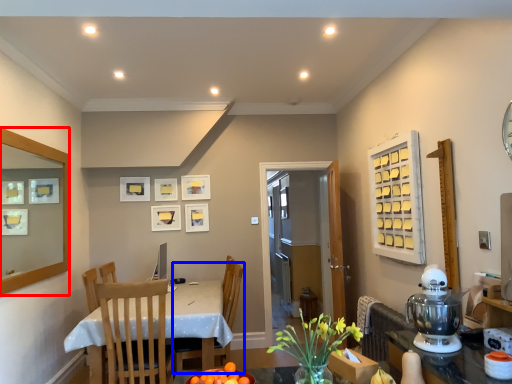
Question: Which point is further to the camera, mirror (highlighted by a red box) or chair (highlighted by a blue box)?

Choices:
 (A) mirror
 (B) chair

Answer: (B)